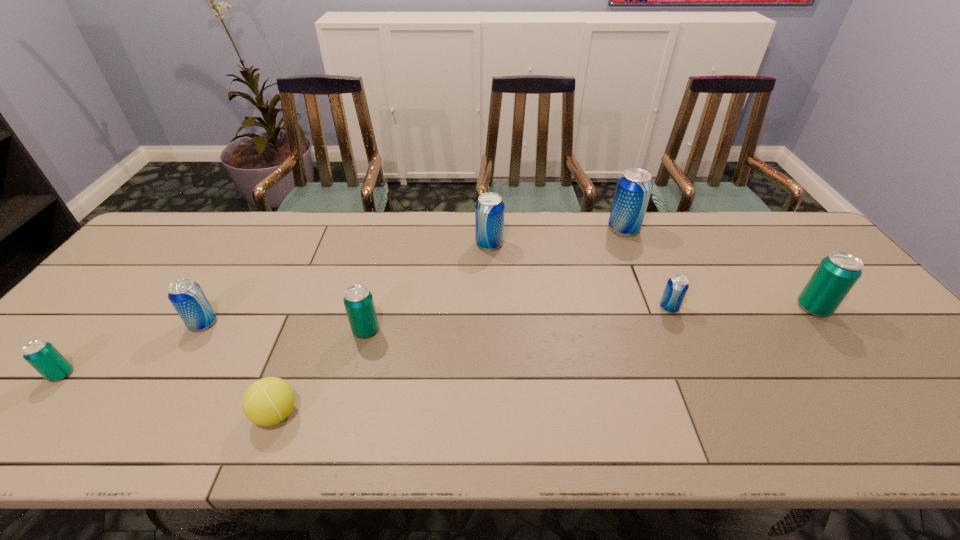
This screenshot has width=960, height=540. Identify the location of free space located on the right of the smallest blue beer can. (829, 307).

Identify the location of vacant space located 0.400m on the back of the nearest teal beer can. The height and width of the screenshot is (540, 960). [160, 257].

The width and height of the screenshot is (960, 540). In order to click on vacant region located on the right of the green tennis ball in this screenshot , I will do `click(365, 414)`.

Where is `object that is positioned at the near edge`? Image resolution: width=960 pixels, height=540 pixels. object that is positioned at the near edge is located at coordinates (267, 402).

The image size is (960, 540). I want to click on object located in the left edge section of the desktop, so click(x=41, y=355).

Find the location of a particular element. Image resolution: width=960 pixels, height=540 pixels. object positioned at the right edge is located at coordinates (835, 276).

Where is `free space at the far edge of the desktop`? Image resolution: width=960 pixels, height=540 pixels. free space at the far edge of the desktop is located at coordinates (536, 226).

In the image, there is a desktop. What are the coordinates of `vacant space at the far left corner` in the screenshot? It's located at (178, 224).

Find the location of a particular element. The height and width of the screenshot is (540, 960). blank region between the farthest teal beer can and the biggest blue beer can is located at coordinates (718, 268).

Locate an element on the screen. The image size is (960, 540). free spot between the leftmost teal beer can and the biggest teal beer can is located at coordinates (438, 341).